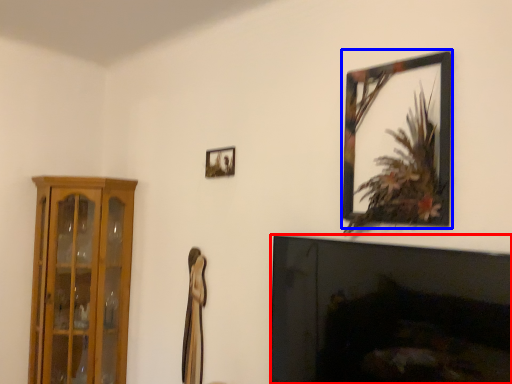
Question: Which point is further to the camera, fireplace (highlighted by a red box) or picture frame (highlighted by a blue box)?

Choices:
 (A) fireplace
 (B) picture frame

Answer: (B)